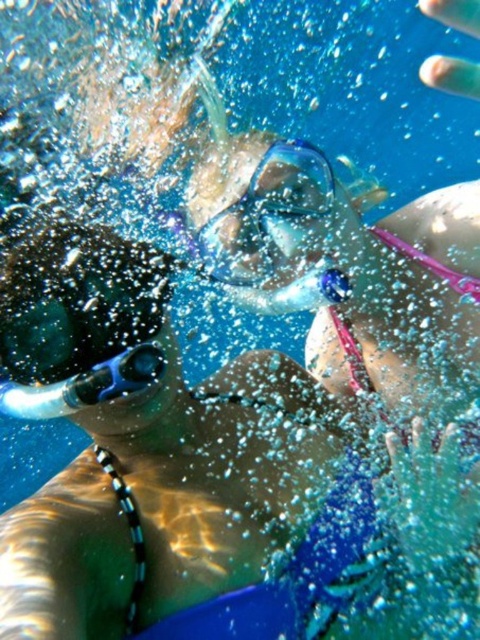
Based on the photo, is transparent plastic goggles at center behind blue rubber snorkel at lower left?

Yes, transparent plastic goggles at center is further from the viewer.

Does point (319, 195) come closer to viewer compared to point (154, 364)?

No, it is behind (154, 364).

Is point (308, 189) closer to camera compared to point (93, 397)?

No, it is not.

Locate an element on the screen. Image resolution: width=480 pixels, height=640 pixels. transparent plastic goggles at center is located at coordinates (268, 216).